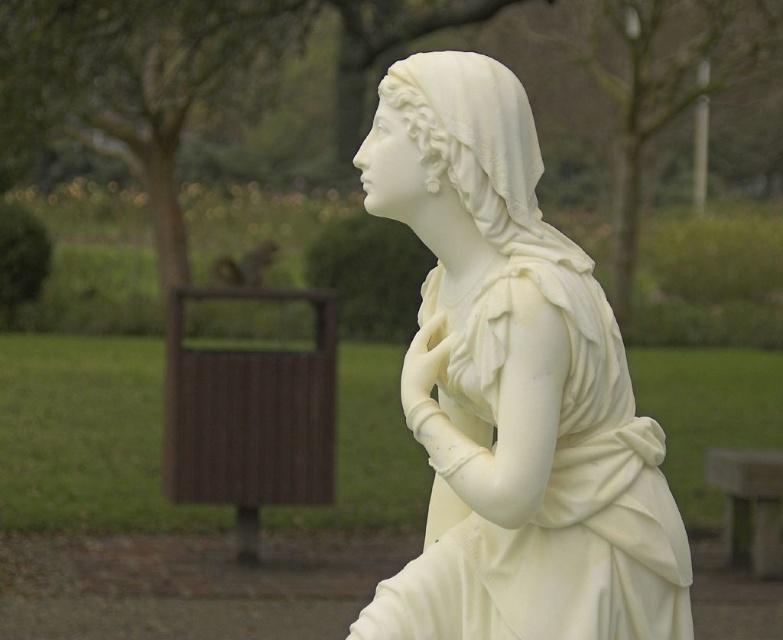
You are standing in a park and see the white marble statue at center. If you walk 2 meters forward from your current position, will you be closer to the statue?

The white marble statue at center is located at point (513, 388). Since you are moving forward, you will be closer to the statue.

You are a photographer wanting to capture both the white marble statue at center and the smooth gray stone bench at lower right in a single frame. Given their sizes, which object will appear bigger in the photo?

The white marble statue at center will appear bigger in the photo because it has a larger size compared to the smooth gray stone bench at lower right.

Based on the photo, you are a photographer who wants to capture a closeup of the white marble statue at center while ensuring the smooth gray stone bench at lower right is still visible in the background. Can you position yourself so that both are in focus?

The white marble statue at center is positioned over smooth gray stone bench at lower right, so if you position yourself directly in front of the statue, the bench will be in the background and still visible. However, since the statue is closer to you than the bench, you might need to adjust your focus or use a smaller aperture to keep both in focus.